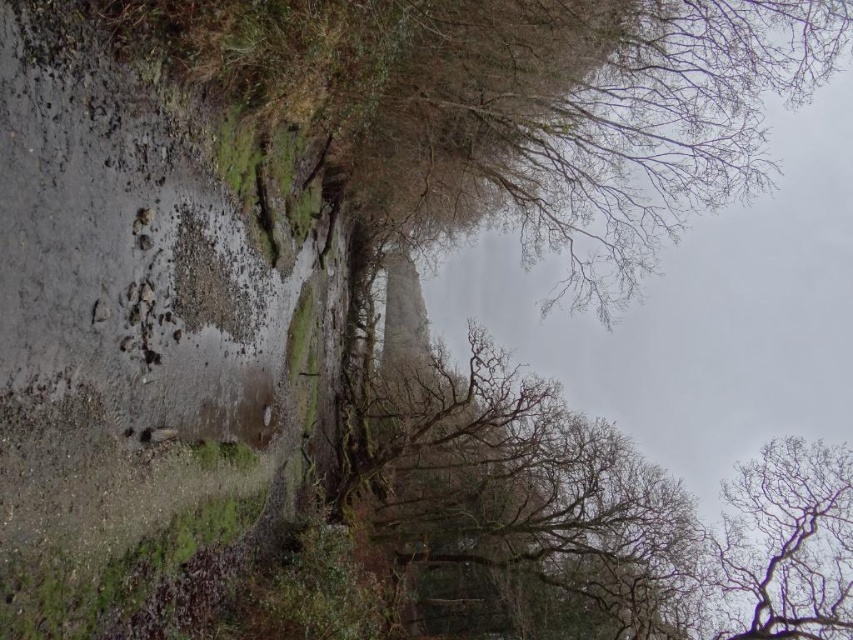
You are a hiker who wants to take a photo of the smooth bark tree at center and the bare branches at upper right. Which object should you focus on first if you want to capture both in a single frame without moving the camera?

You should focus on the smooth bark tree at center first because it is bigger than the bare branches at upper right, so it will occupy more space in the frame and ensure proper focus on the larger subject.

You are a photographer planning to capture the damp soil at lower left and the bare branches at upper right in a single frame. Which of these two elements will occupy more horizontal space in your photo?

The damp soil at lower left will occupy more horizontal space in the photo because its width surpasses that of the bare branches at upper right.

You are a hiker who has just finished a long trek and wants to set up your tent. You notice the damp soil at lower left. Based on its location, can you determine if this area is suitable for camping?

The damp soil at lower left is located at point [142,326], which may indicate a low area prone to pooling water. This could make it unsuitable for camping as damp ground might lead to discomfort or damage to equipment.